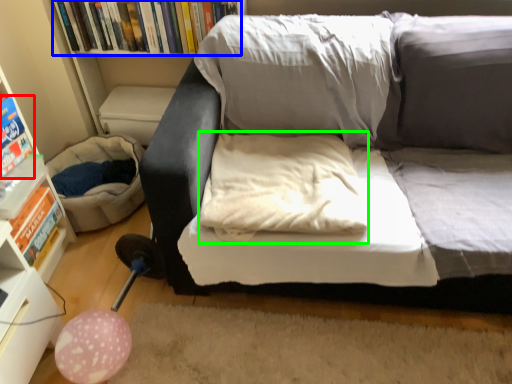
Question: Which object is positioned farthest from paperback book (highlighted by a red box)? Select from book (highlighted by a blue box) and pillow (highlighted by a green box).

Choices:
 (A) book
 (B) pillow

Answer: (B)